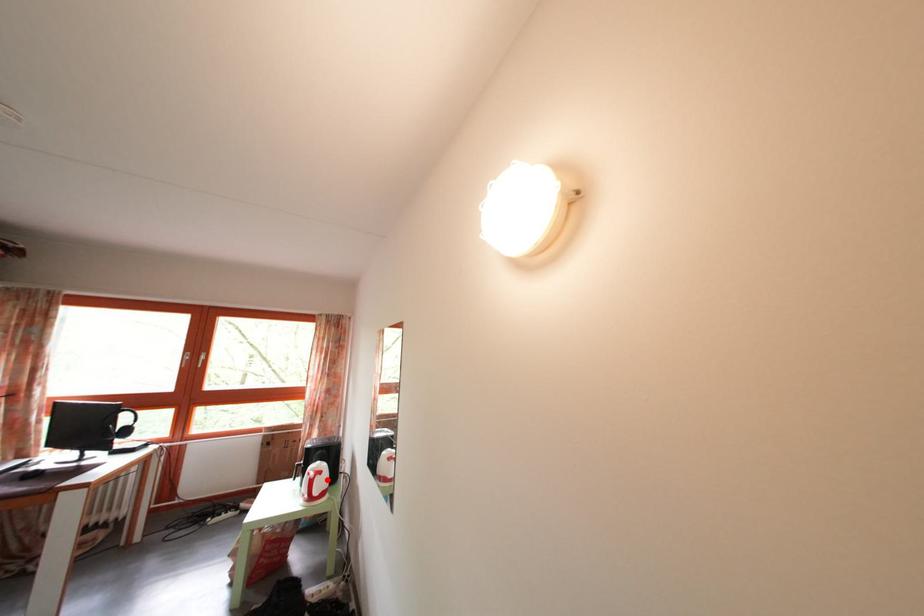
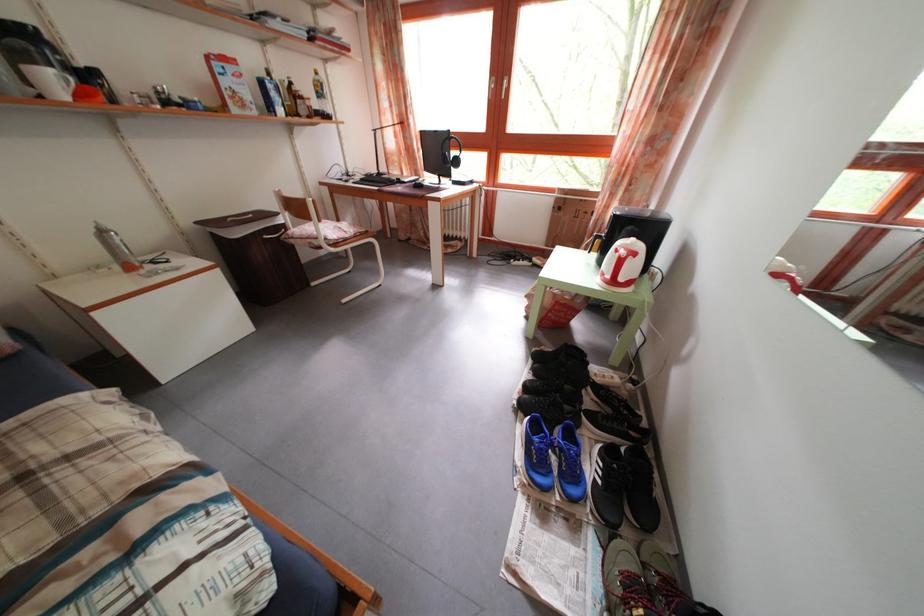
Find the pixel in the second image that matches the highlighted location in the first image.

(641, 262)